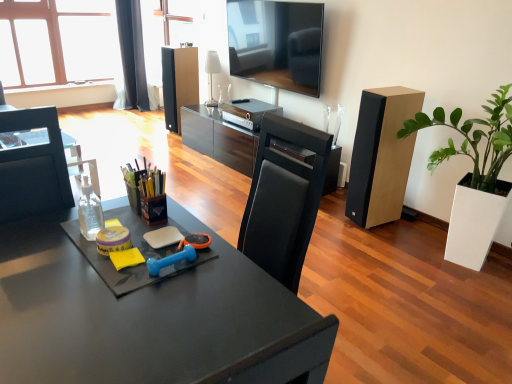
Image resolution: width=512 pixels, height=384 pixels. Find the location of `free space in front of clear plastic bottle at left`. free space in front of clear plastic bottle at left is located at coordinates (73, 263).